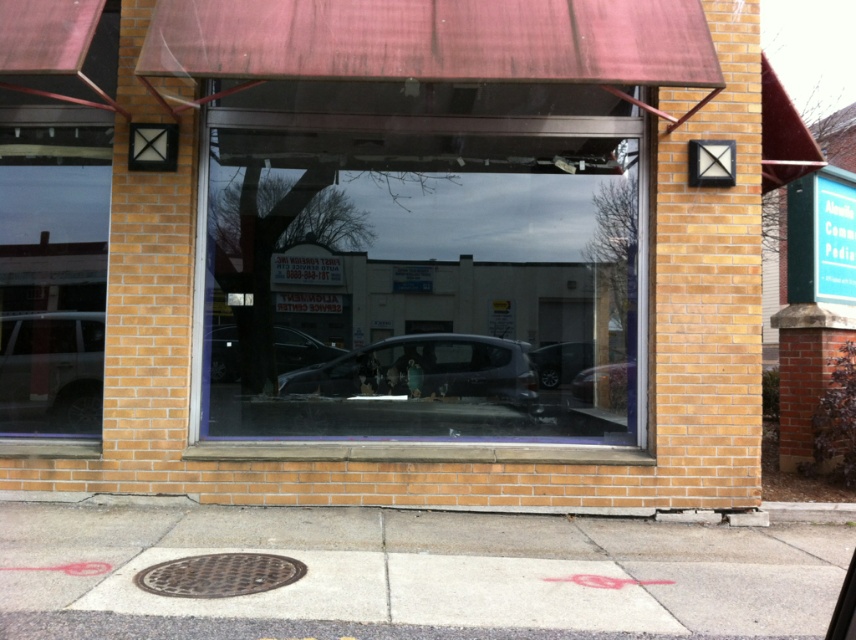
Question: Which of these objects is positioned farthest from the matte silver car at left?

Choices:
 (A) brown concrete curb at lower center
 (B) transparent glass window at center

Answer: (A)

Question: Among these points, which one is farthest from the camera?

Choices:
 (A) (366, 394)
 (B) (610, 371)
 (C) (33, 337)

Answer: (A)

Question: Is the position of transparent glass window at center less distant than that of shiny black sedan at center?

Choices:
 (A) no
 (B) yes

Answer: (B)

Question: Is transparent glass window at center to the left of brown concrete curb at lower center from the viewer's perspective?

Choices:
 (A) no
 (B) yes

Answer: (B)

Question: Which point is farther from the camera taking this photo?

Choices:
 (A) (239, 376)
 (B) (629, 388)

Answer: (A)

Question: Is transparent glass window at center to the right of shiny black car at center from the viewer's perspective?

Choices:
 (A) yes
 (B) no

Answer: (B)